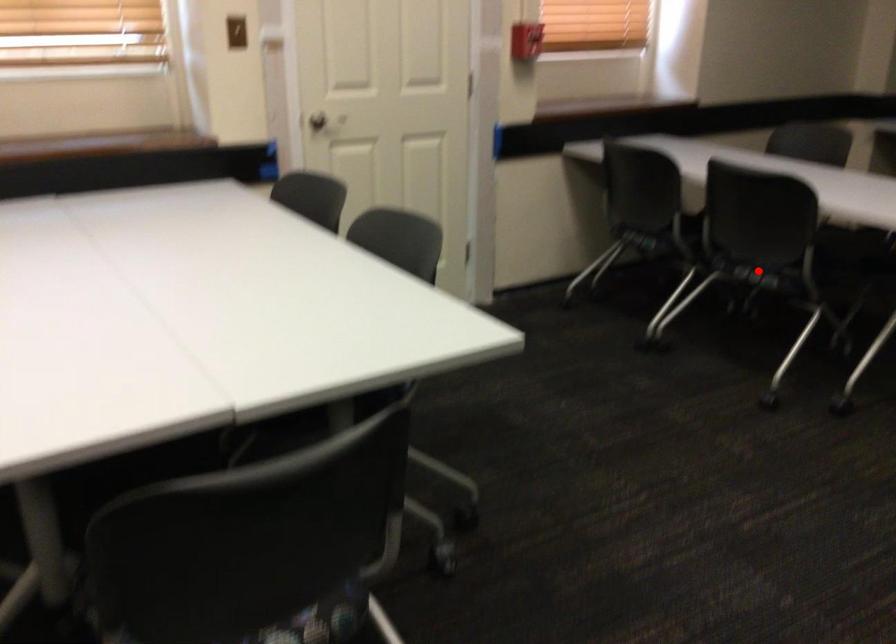
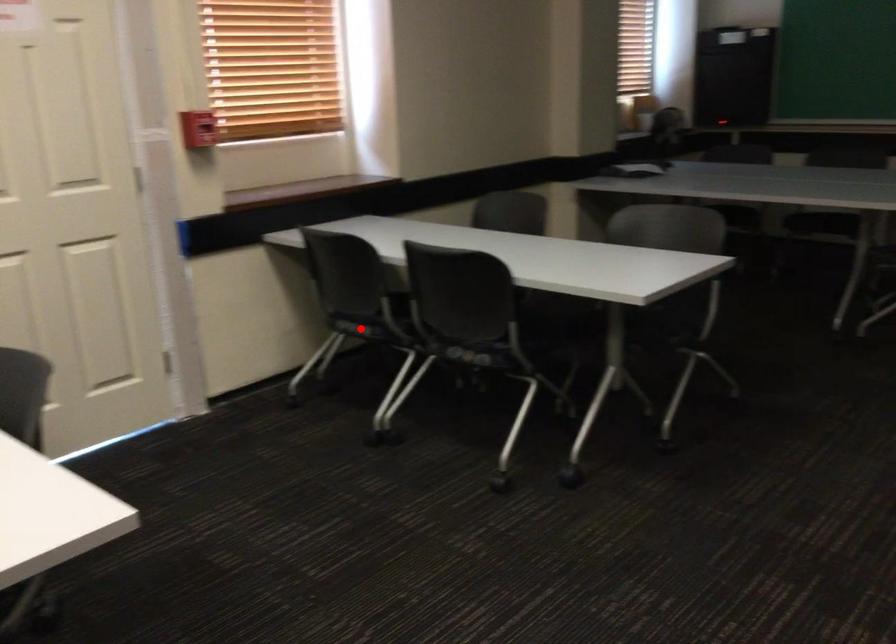
I am providing you with two images of the same scene from different viewpoints. A red point is marked on the first image and another point is marked on the second image. Do the highlighted points in image1 and image2 indicate the same real-world spot?

No